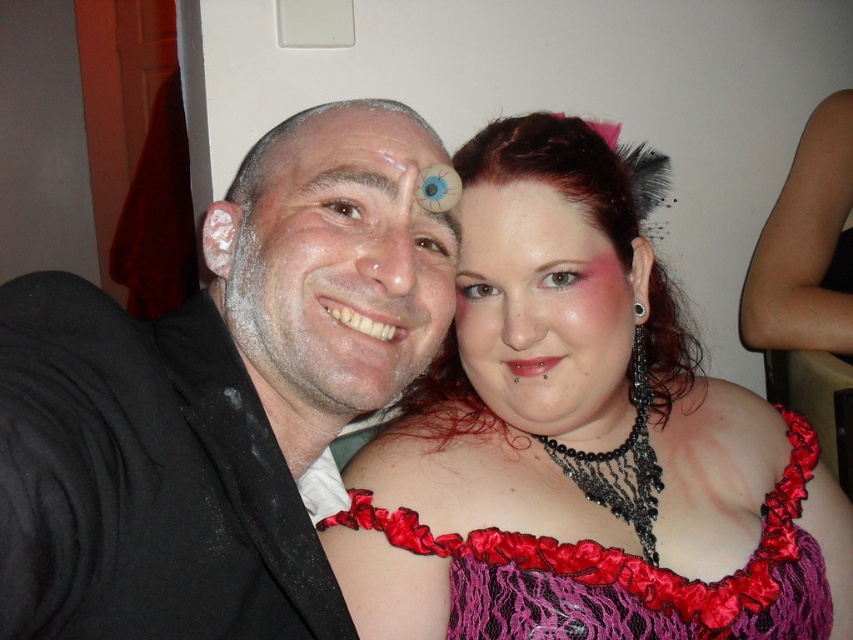
You are a photographer adjusting your camera settings. You notice the matte black suit at left and the matte white face at center in the frame. Which object should you focus on first to ensure proper depth of field?

The matte black suit at left is closer to the viewer than the matte white face at center, so you should focus on the matte black suit at left first to achieve proper depth of field.

You are a photographer trying to adjust the lighting for a photo shoot. You notice the matte black suit at left and the matte white face at center. Which object will reflect more light?

The matte white face at center will reflect more light because white surfaces reflect more light than black ones.

You are standing in the room where the photo was taken. If you want to find the matte red lace dress at center, where should you look?

You should look at point (581, 442) to find the matte red lace dress at center.